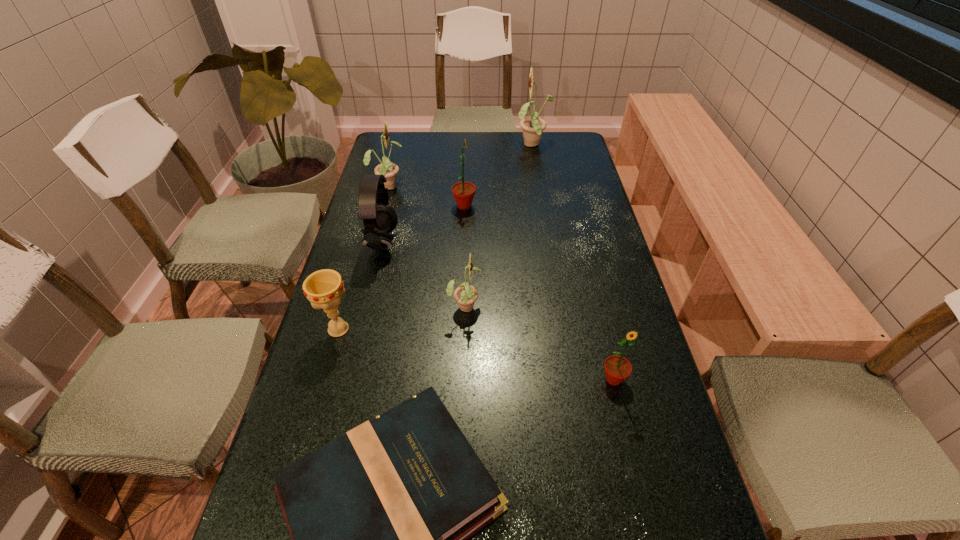
Find the location of a particular element. The image size is (960, 540). vacant space located on the face of the nearest sunflower is located at coordinates (622, 416).

Identify the location of free location located 0.400m on the right of the chalice. (517, 329).

You are a GUI agent. You are given a task and a screenshot of the screen. Output one action in this format:
    pyautogui.click(x=<x>, y=<y>)
    Task: Click on the object at the far edge
    
    Given the screenshot: What is the action you would take?
    pyautogui.click(x=533, y=127)

Where is `sunflower that is at the left edge`? sunflower that is at the left edge is located at coordinates (389, 170).

At what (x,y) coordinates should I click in order to perform the action: click on earphone present at the left edge. Please return your answer as a coordinate pair (x, y). The width and height of the screenshot is (960, 540). Looking at the image, I should click on (379, 219).

Image resolution: width=960 pixels, height=540 pixels. Find the location of `chalice present at the left edge`. chalice present at the left edge is located at coordinates (324, 288).

You are a GUI agent. You are given a task and a screenshot of the screen. Output one action in this format:
    pyautogui.click(x=<x>, y=<y>)
    Task: Click on the object at the far right corner
    The width and height of the screenshot is (960, 540).
    Given the screenshot: What is the action you would take?
    pyautogui.click(x=533, y=127)

At what (x,y) coordinates should I click in order to perform the action: click on free space at the far edge of the desktop. Please return your answer as a coordinate pair (x, y). Looking at the image, I should click on (470, 139).

Where is `vacant space at the left edge of the desktop`? This screenshot has height=540, width=960. vacant space at the left edge of the desktop is located at coordinates (286, 530).

Locate an element on the screen. The width and height of the screenshot is (960, 540). vacant space at the right edge is located at coordinates (612, 288).